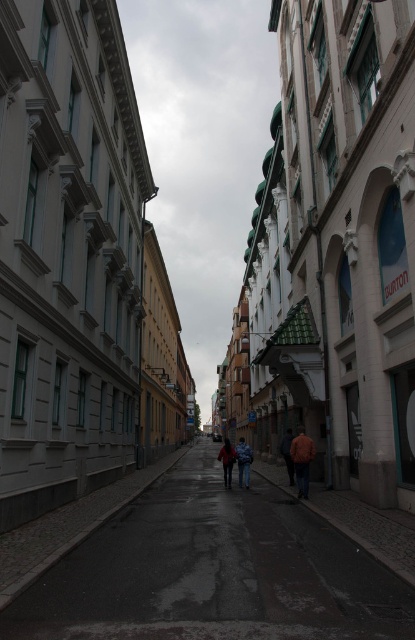
Question: Does orange leather jacket at center come in front of dark blue jeans at center?

Choices:
 (A) no
 (B) yes

Answer: (B)

Question: Among these points, which one is farthest from the camera?

Choices:
 (A) (287, 444)
 (B) (244, 451)

Answer: (A)

Question: Is blue denim jacket at center positioned before dark blue jeans at center?

Choices:
 (A) yes
 (B) no

Answer: (A)

Question: Does dark asphalt road at center have a lesser width compared to orange leather jacket at center?

Choices:
 (A) yes
 (B) no

Answer: (B)

Question: Among these points, which one is nearest to the camera?

Choices:
 (A) (239, 442)
 (B) (341, 632)

Answer: (B)

Question: Which object appears farthest from the camera in this image?

Choices:
 (A) dark blue jeans at center
 (B) orange fabric jacket at center
 (C) dark asphalt road at center

Answer: (A)